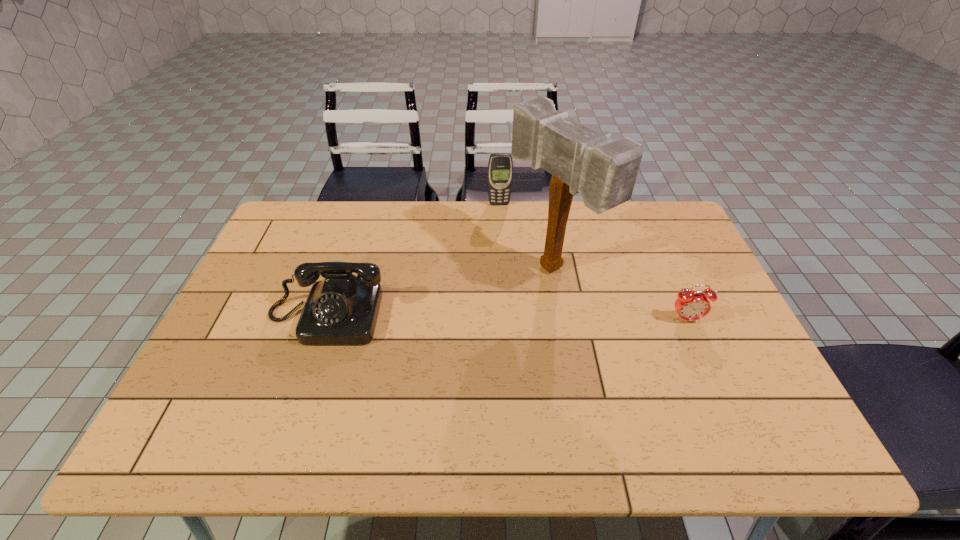
Identify the location of free space at the right edge. (678, 278).

Locate an element on the screen. This screenshot has width=960, height=540. vacant space at the far left corner of the desktop is located at coordinates (292, 213).

You are a GUI agent. You are given a task and a screenshot of the screen. Output one action in this format:
    pyautogui.click(x=<x>, y=<y>)
    Task: Click on the vacant space at the far right corner of the desktop
    This screenshot has width=960, height=540.
    Given the screenshot: What is the action you would take?
    pyautogui.click(x=636, y=225)

In the image, there is a desktop. In order to click on vacant space at the near right corner in this screenshot , I will do [x=768, y=404].

This screenshot has height=540, width=960. In order to click on vacant area between the alarm clock and the telephone in this screenshot , I will do `click(506, 318)`.

At what (x,y) coordinates should I click in order to perform the action: click on free space between the alarm clock and the telephone. Please return your answer as a coordinate pair (x, y). Image resolution: width=960 pixels, height=540 pixels. Looking at the image, I should click on (506, 318).

Image resolution: width=960 pixels, height=540 pixels. In order to click on vacant area that lies between the telephone and the rightmost object in this screenshot , I will do `click(506, 318)`.

This screenshot has height=540, width=960. Find the location of `empty location between the rightmost object and the tallest object`. empty location between the rightmost object and the tallest object is located at coordinates (619, 294).

This screenshot has width=960, height=540. I want to click on free space between the rightmost object and the mallet, so click(619, 294).

This screenshot has width=960, height=540. I want to click on empty space that is in between the mallet and the rightmost object, so click(x=619, y=294).